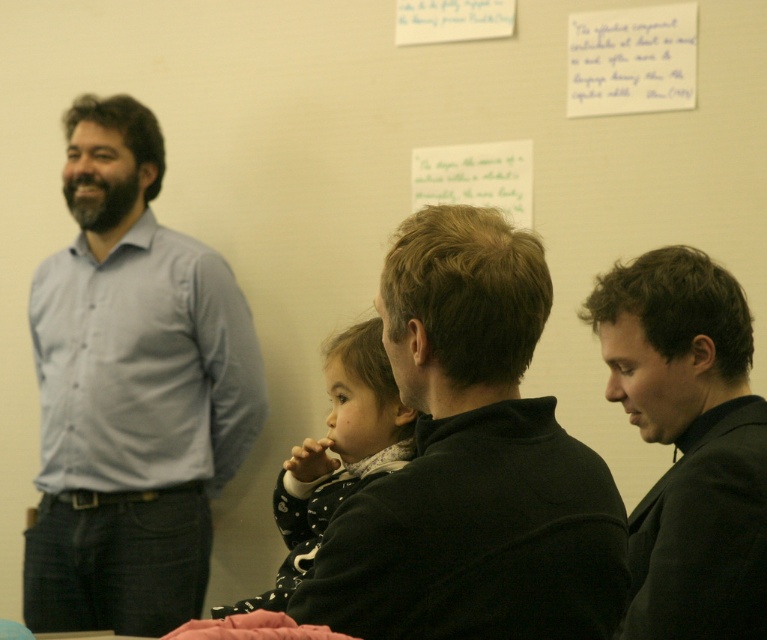
Is point (38, 561) behind point (680, 502)?

Yes.

Who is positioned more to the left, light blue shirt at left or black matte jacket at right?

light blue shirt at left

The width and height of the screenshot is (767, 640). In order to click on light blue shirt at left in this screenshot , I will do point(130,392).

Does black matte jacket at right have a smaller size compared to white dotted coat at center?

No.

Does black matte jacket at right have a lesser width compared to white dotted coat at center?

Yes, black matte jacket at right is thinner than white dotted coat at center.

Where is `black matte jacket at right`? The image size is (767, 640). black matte jacket at right is located at coordinates (690, 444).

Which is in front, point (415, 342) or point (282, 486)?

Point (415, 342) is more forward.

Does point (456, 486) come closer to viewer compared to point (295, 458)?

That is True.

This screenshot has width=767, height=640. Describe the element at coordinates (471, 461) in the screenshot. I see `black fleece at center` at that location.

You are a GUI agent. You are given a task and a screenshot of the screen. Output one action in this format:
    pyautogui.click(x=<x>, y=<y>)
    Task: Click on the black fleece at center
    This screenshot has width=767, height=640.
    Given the screenshot: What is the action you would take?
    pyautogui.click(x=471, y=461)